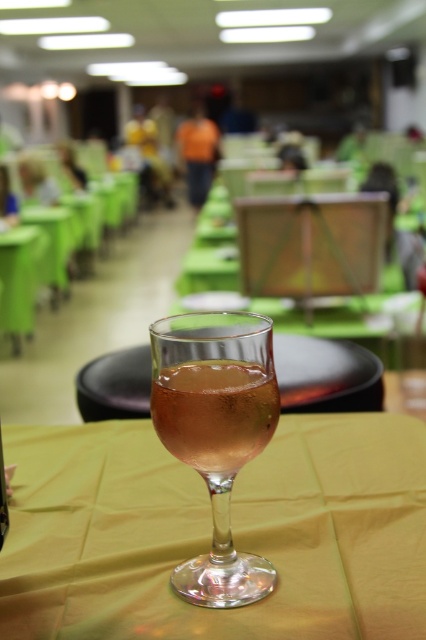
You are a server in a restaurant and need to place a tray on the green fabric table at lower left. What are the coordinates where you should place the tray?

The green fabric table at lower left is located at point (19, 282), so you should place the tray at those coordinates.

You are a waiter in a restaurant and need to place a new menu on the table. The menu is 10 inches wide. Can you place it on the green fabric table at lower left without overlapping the translucent glass at center?

The translucent glass at center is smaller than the green fabric table at lower left. Since the menu is 10 inches wide, it can be placed on the green fabric table at lower left as long as it doesn t overlap the smaller translucent glass at center.